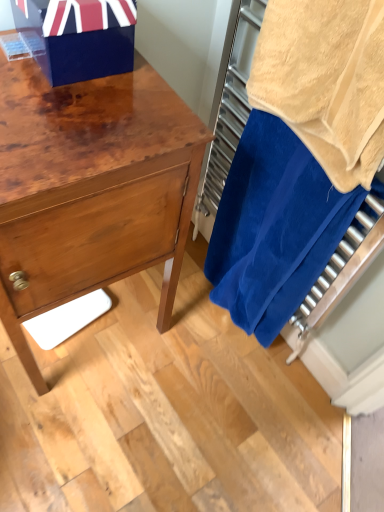
At what (x,y) coordinates should I click in order to perform the action: click on vacant area in front of shiny wood chest of drawers at left. Please return your answer as a coordinate pair (x, y). The image size is (384, 512). Looking at the image, I should click on (87, 436).